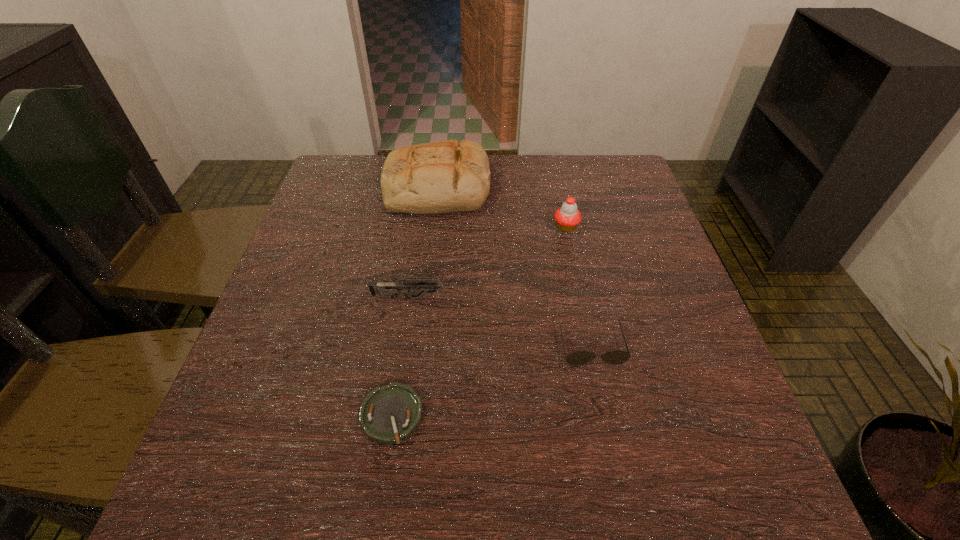
Select which object is the third closest to the second shortest object. Please provide its 2D coordinates. Your answer should be formatted as a tuple, i.e. [(x, y)], where the tuple contains the x and y coordinates of a point satisfying the conditions above.

[(567, 217)]

The height and width of the screenshot is (540, 960). In order to click on blank area in the image that satisfies the following two spatial constraints: 1. on the front side of the cupcake; 2. aimed along the barrel of the gun in this screenshot , I will do `click(581, 298)`.

Identify the location of vacant space that satisfies the following two spatial constraints: 1. on the front side of the cupcake; 2. on the left side of the bread. (433, 227).

This screenshot has height=540, width=960. What are the coordinates of `vacant area that satisfies the following two spatial constraints: 1. on the back side of the shortest object; 2. on the left side of the second tallest object` in the screenshot? It's located at (420, 227).

At what (x,y) coordinates should I click in order to perform the action: click on vacant area in the image that satisfies the following two spatial constraints: 1. on the back side of the second tallest object; 2. on the right side of the shortest object. Please return your answer as a coordinate pair (x, y). Image resolution: width=960 pixels, height=540 pixels. Looking at the image, I should click on (420, 227).

Image resolution: width=960 pixels, height=540 pixels. I want to click on vacant space that satisfies the following two spatial constraints: 1. on the back side of the nearest object; 2. on the left side of the fourth shortest object, so click(x=420, y=227).